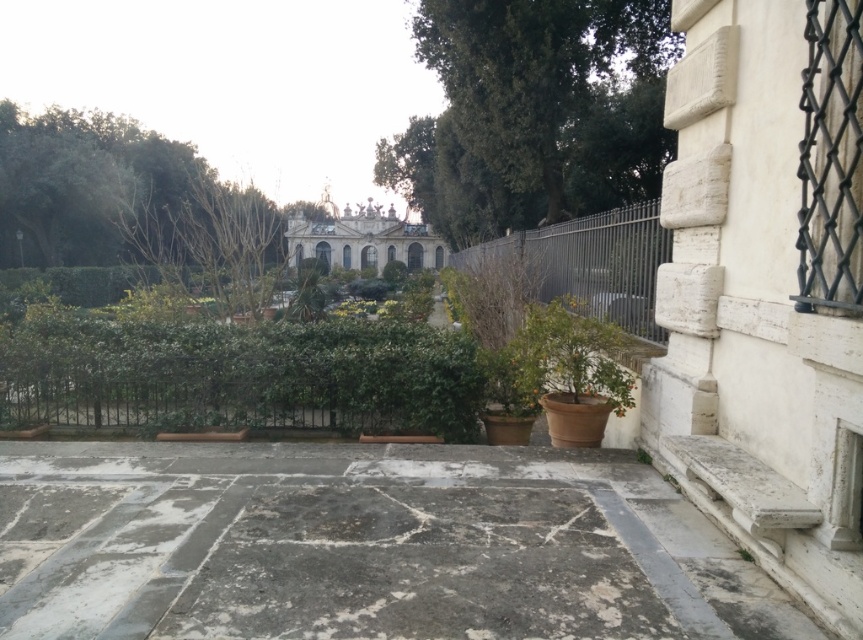
This screenshot has width=863, height=640. What do you see at coordinates (364, 547) in the screenshot? I see `gray stone pavement at center` at bounding box center [364, 547].

Who is more distant from viewer, (345,544) or (564,273)?

Point (564,273)

Image resolution: width=863 pixels, height=640 pixels. What do you see at coordinates (364, 547) in the screenshot?
I see `gray stone pavement at center` at bounding box center [364, 547].

The image size is (863, 640). Find the location of `gray stone pavement at center`. gray stone pavement at center is located at coordinates (364, 547).

Is metallic wire fence at center smaller than green matte plant at lower right?

Incorrect, metallic wire fence at center is not smaller in size than green matte plant at lower right.

Looking at this image, who is taller, metallic wire fence at center or green matte plant at lower right?

With more height is metallic wire fence at center.

Locate an element on the screen. Image resolution: width=863 pixels, height=640 pixels. metallic wire fence at center is located at coordinates (589, 262).

Where is `gray stone pavement at center`? gray stone pavement at center is located at coordinates (364, 547).

Is gray stone pavement at center to the left of green matte plant at lower right from the viewer's perspective?

Correct, you'll find gray stone pavement at center to the left of green matte plant at lower right.

You are a GUI agent. You are given a task and a screenshot of the screen. Output one action in this format:
    pyautogui.click(x=<x>, y=<y>)
    Task: Click on the gray stone pavement at center
    Image resolution: width=863 pixels, height=640 pixels.
    Given the screenshot: What is the action you would take?
    pyautogui.click(x=364, y=547)